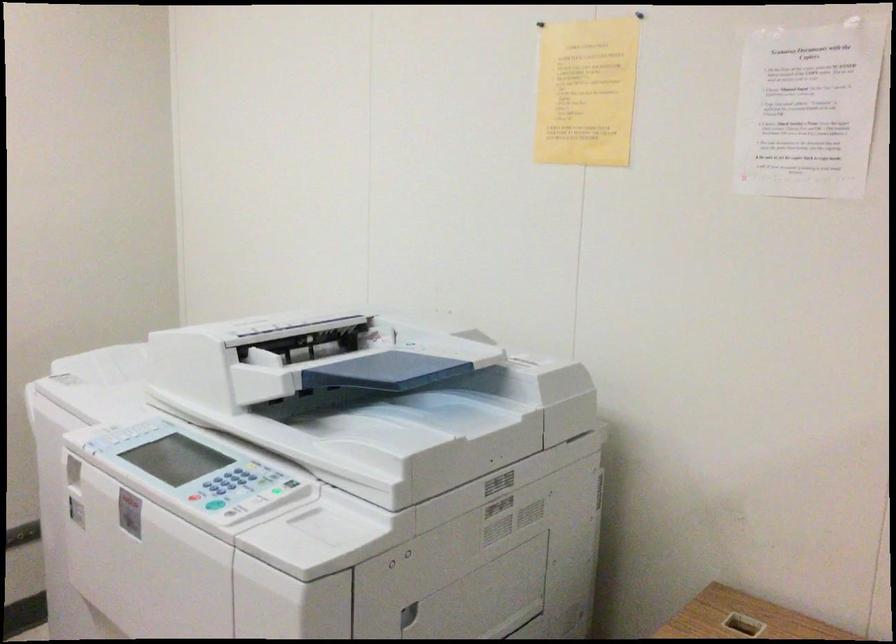
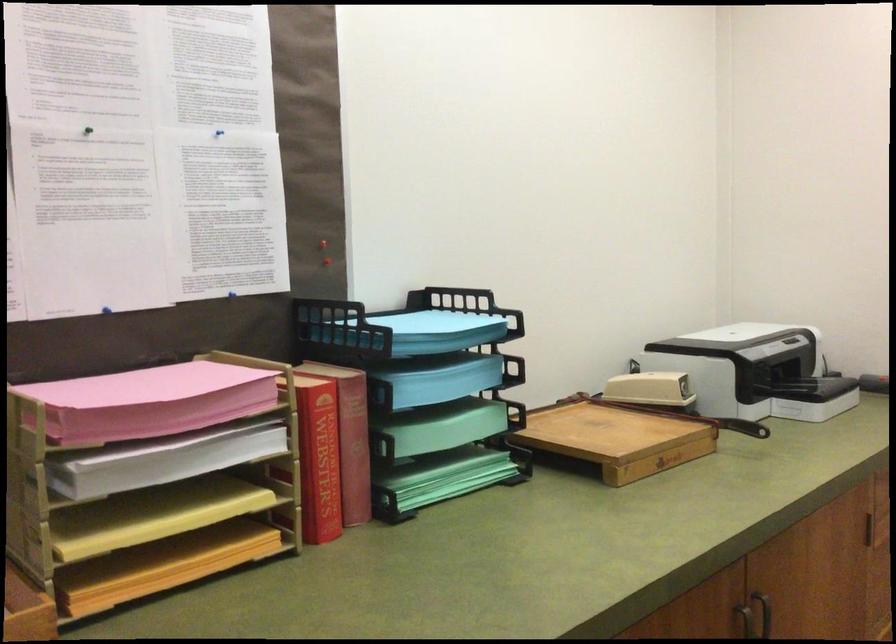
Question: The camera is either moving clockwise (left) or counter-clockwise (right) around the object. The first image is from the beginning of the video and the second image is from the end. Is the camera moving left or right when shooting the video?

Choices:
 (A) Left
 (B) Right

Answer: (B)